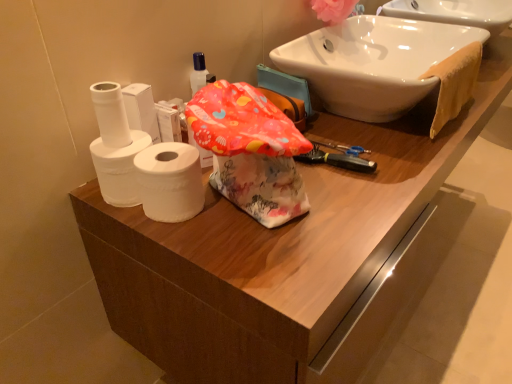
What are the coordinates of `vacant area that lies in front of white matte toilet paper at left, positioned as the first toilet paper in right-to-left order` in the screenshot? It's located at (197, 252).